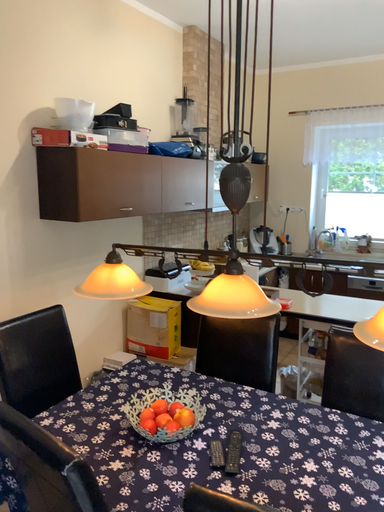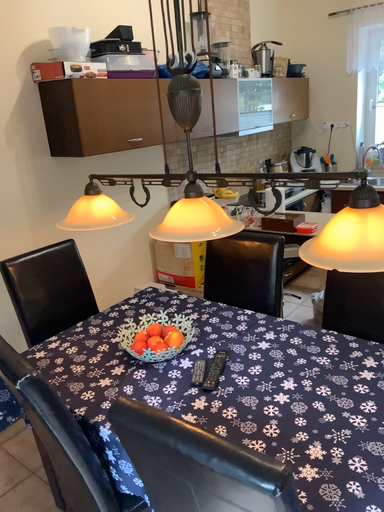
Question: Which way did the camera rotate in the video?

Choices:
 (A) rotated downward
 (B) rotated upward

Answer: (A)